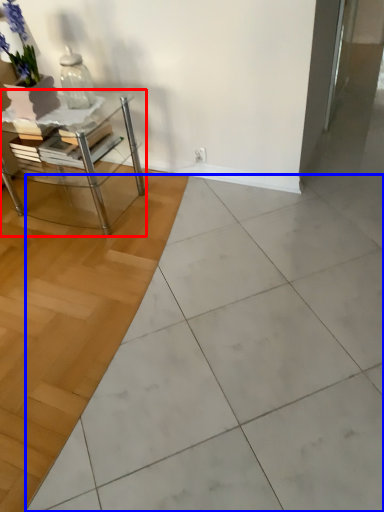
Question: Which point is further to the camera, table (highlighted by a red box) or ceramic tile (highlighted by a blue box)?

Choices:
 (A) table
 (B) ceramic tile

Answer: (A)